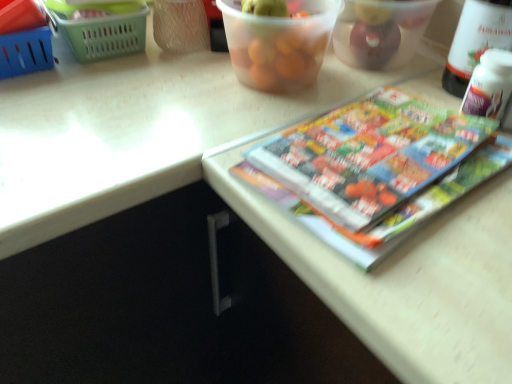
Question: Is white plastic bottle at upper right to the right of green plastic basket at upper left, which appears as the 2th basket when viewed from the left, from the viewer's perspective?

Choices:
 (A) no
 (B) yes

Answer: (B)

Question: Does white plastic bottle at upper right lie behind green plastic basket at upper left, which appears as the 1th basket when viewed from the right?

Choices:
 (A) no
 (B) yes

Answer: (A)

Question: Is white plastic bottle at upper right oriented towards green plastic basket at upper left, which appears as the 2th basket when viewed from the left?

Choices:
 (A) no
 (B) yes

Answer: (A)

Question: Considering the relative sizes of white plastic bottle at upper right and green plastic basket at upper left, which appears as the 1th basket when viewed from the right, in the image provided, is white plastic bottle at upper right taller than green plastic basket at upper left, which appears as the 1th basket when viewed from the right,?

Choices:
 (A) no
 (B) yes

Answer: (B)

Question: From a real-world perspective, is white plastic bottle at upper right below green plastic basket at upper left, which appears as the 1th basket when viewed from the right?

Choices:
 (A) yes
 (B) no

Answer: (B)

Question: Would you say white plastic bottle at upper right is a long distance from green plastic basket at upper left, which appears as the 2th basket when viewed from the left?

Choices:
 (A) no
 (B) yes

Answer: (A)

Question: Is blue plastic basket at upper left, the 2th basket from the right, facing away from translucent plastic container at upper center, which ranks as the second glass bowl in left-to-right order?

Choices:
 (A) yes
 (B) no

Answer: (B)

Question: From the image's perspective, would you say blue plastic basket at upper left, acting as the first basket starting from the left, is positioned over translucent plastic container at upper center, which appears as the 1th glass bowl when viewed from the right?

Choices:
 (A) no
 (B) yes

Answer: (A)

Question: Is blue plastic basket at upper left, acting as the first basket starting from the left, smaller than translucent plastic container at upper center, which appears as the 1th glass bowl when viewed from the right?

Choices:
 (A) yes
 (B) no

Answer: (A)

Question: From a real-world perspective, is blue plastic basket at upper left, acting as the first basket starting from the left, positioned over translucent plastic container at upper center, which appears as the 1th glass bowl when viewed from the right, based on gravity?

Choices:
 (A) no
 (B) yes

Answer: (A)

Question: Is blue plastic basket at upper left, the 2th basket from the right, next to translucent plastic container at upper center, which appears as the 1th glass bowl when viewed from the right?

Choices:
 (A) no
 (B) yes

Answer: (A)

Question: Is blue plastic basket at upper left, acting as the first basket starting from the left, further to camera compared to translucent plastic container at upper center, which appears as the 1th glass bowl when viewed from the right?

Choices:
 (A) yes
 (B) no

Answer: (A)

Question: Is transparent plastic container at upper center, which appears as the 2th glass bowl when viewed from the right, surrounded by white plastic bottle at upper right?

Choices:
 (A) yes
 (B) no

Answer: (B)